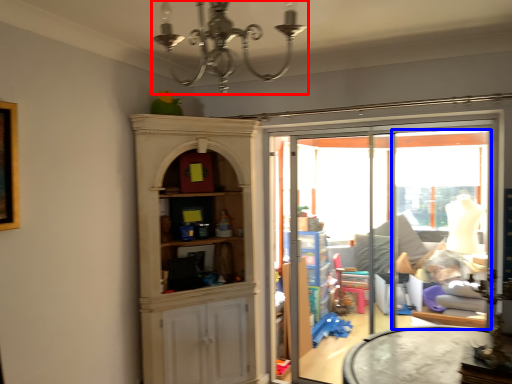
Question: Which object is closer to the camera taking this photo, light fixture (highlighted by a red box) or window (highlighted by a blue box)?

Choices:
 (A) light fixture
 (B) window

Answer: (A)